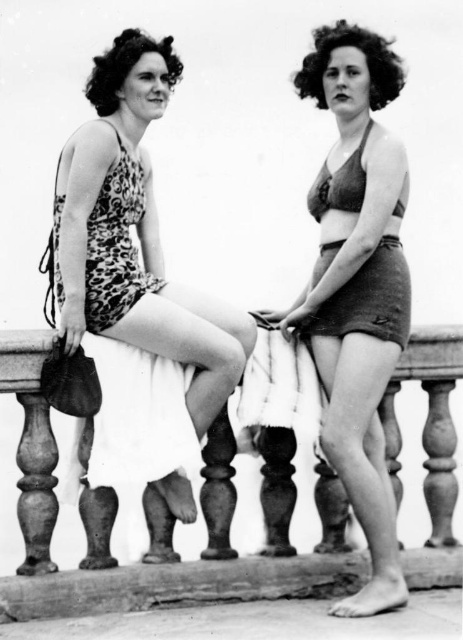
Does point (142, 90) lie in front of point (451, 362)?

No.

Who is higher up, leopard print swimsuit at left or wooden balustrade at center?

leopard print swimsuit at left

What do you see at coordinates (131, 240) in the screenshot? I see `leopard print swimsuit at left` at bounding box center [131, 240].

The image size is (463, 640). What are the coordinates of `leopard print swimsuit at left` in the screenshot? It's located at (131, 240).

Is matte brown shorts at center smaller than matte brown bikini top at center?

Incorrect, matte brown shorts at center is not smaller in size than matte brown bikini top at center.

Describe the element at coordinates (356, 285) in the screenshot. This screenshot has height=640, width=463. I see `matte brown shorts at center` at that location.

This screenshot has height=640, width=463. I want to click on matte brown shorts at center, so click(x=356, y=285).

Does wooden balustrade at center appear over matte brown bikini top at center?

No, wooden balustrade at center is not above matte brown bikini top at center.

Find the location of a particular element. This screenshot has height=640, width=463. wooden balustrade at center is located at coordinates (129, 560).